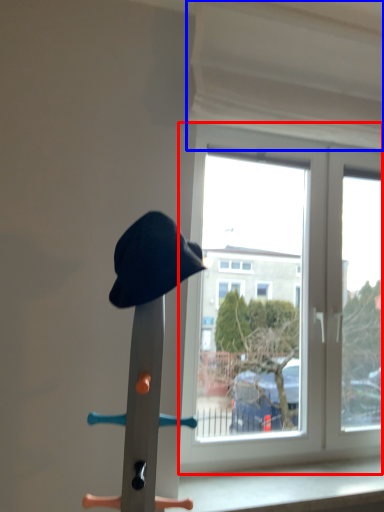
Question: Which point is closer to the camera, window (highlighted by a red box) or curtain (highlighted by a blue box)?

Choices:
 (A) window
 (B) curtain

Answer: (B)